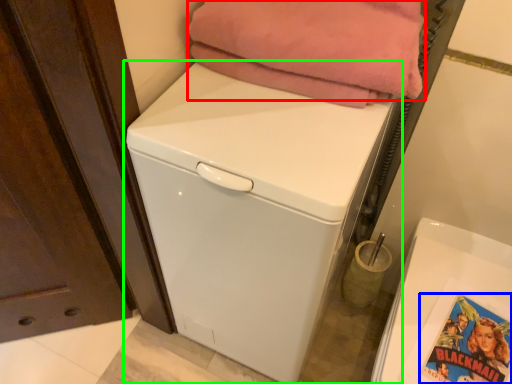
Question: Which is nearer to the blanket (highlighted by a red box)? comic book (highlighted by a blue box) or washing machine (highlighted by a green box).

Choices:
 (A) comic book
 (B) washing machine

Answer: (B)